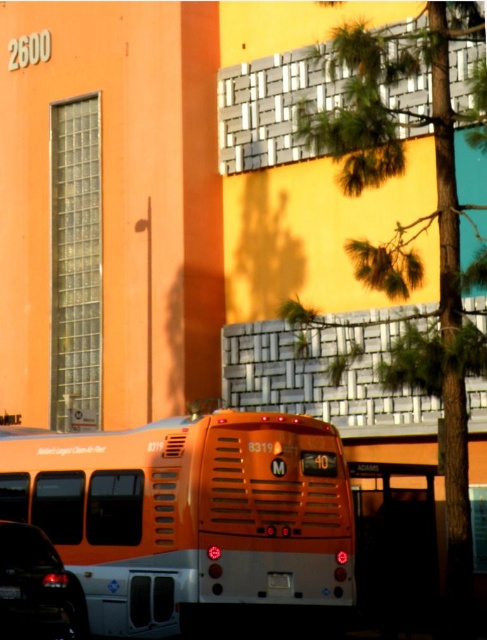
Does orange matte bus at center appear on the left side of shiny black sedan at lower left?

No, orange matte bus at center is not to the left of shiny black sedan at lower left.

Is orange matte bus at center closer to camera compared to shiny black sedan at lower left?

No, orange matte bus at center is behind shiny black sedan at lower left.

In order to click on orange matte bus at center in this screenshot , I will do `click(189, 518)`.